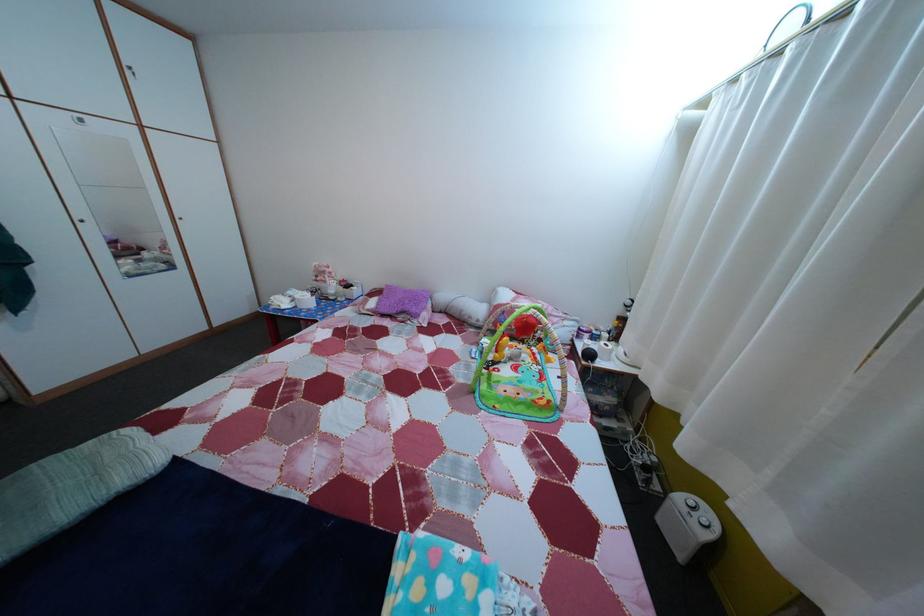
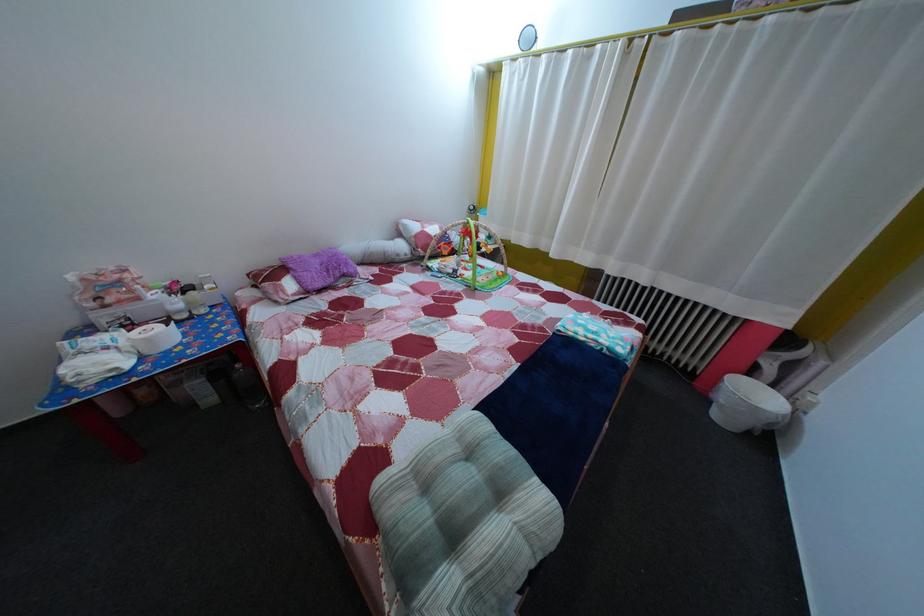
In the second image, find the point that corresponds to point 422,564 in the first image.

(578, 334)